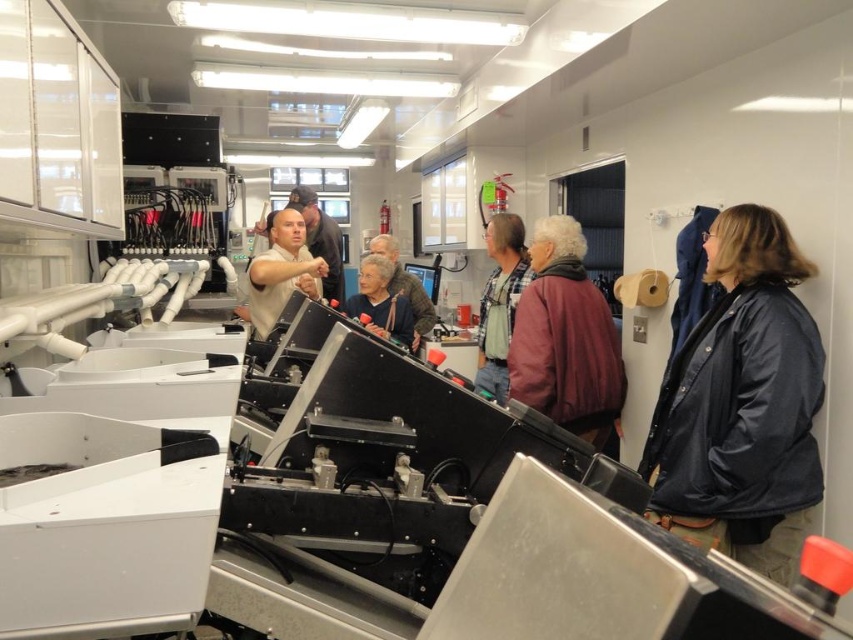
Question: Does dark blue jacket at right appear on the left side of matte black jacket at center?

Choices:
 (A) no
 (B) yes

Answer: (A)

Question: Which of the following is the farthest from the observer?

Choices:
 (A) dark blue jacket at right
 (B) matte black jacket at center
 (C) matte blue jacket at center

Answer: (B)

Question: Which point is farther to the camera?

Choices:
 (A) (405, 284)
 (B) (282, 275)
 (C) (799, 385)
 (D) (497, 339)

Answer: (A)

Question: Observing the image, what is the correct spatial positioning of dark blue jacket at right in reference to matte white shirt at center?

Choices:
 (A) right
 (B) left

Answer: (A)

Question: Can you confirm if plaid shirt at center is positioned above matte blue jacket at center?

Choices:
 (A) yes
 (B) no

Answer: (B)

Question: Among these points, which one is farthest from the camera?

Choices:
 (A) (503, 312)
 (B) (701, 394)
 (C) (305, 280)
 (D) (384, 300)

Answer: (D)